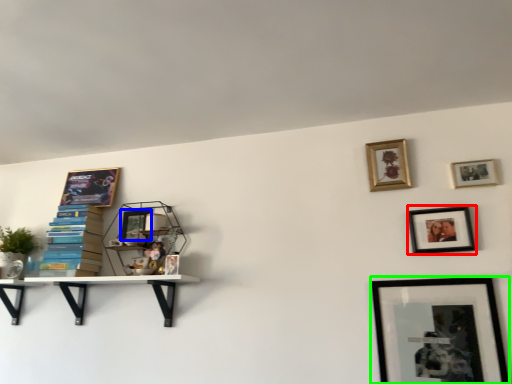
Question: Estimate the real-world distances between objects in this image. Which object is farther from picture frame (highlighted by a red box), picture frame (highlighted by a blue box) or picture frame (highlighted by a green box)?

Choices:
 (A) picture frame
 (B) picture frame

Answer: (A)